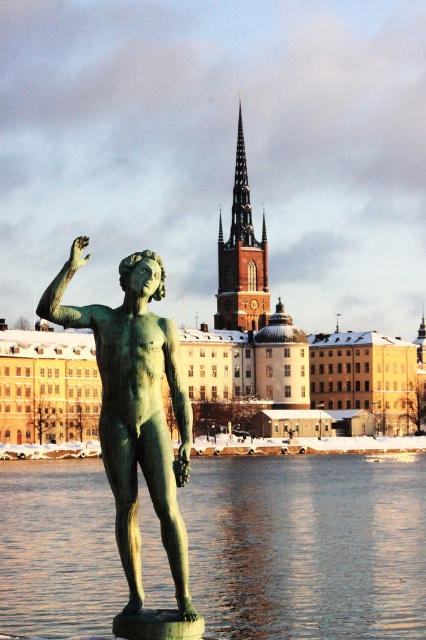
You are standing in the winter scene and want to take a photo of the green patina statue at center and the green reflective water at statue front. To ensure both are in the frame, where should you position yourself relative to the statue?

You should position yourself to the left of the green patina statue at center so that the green reflective water at statue front is visible to the right of the statue in the photo.